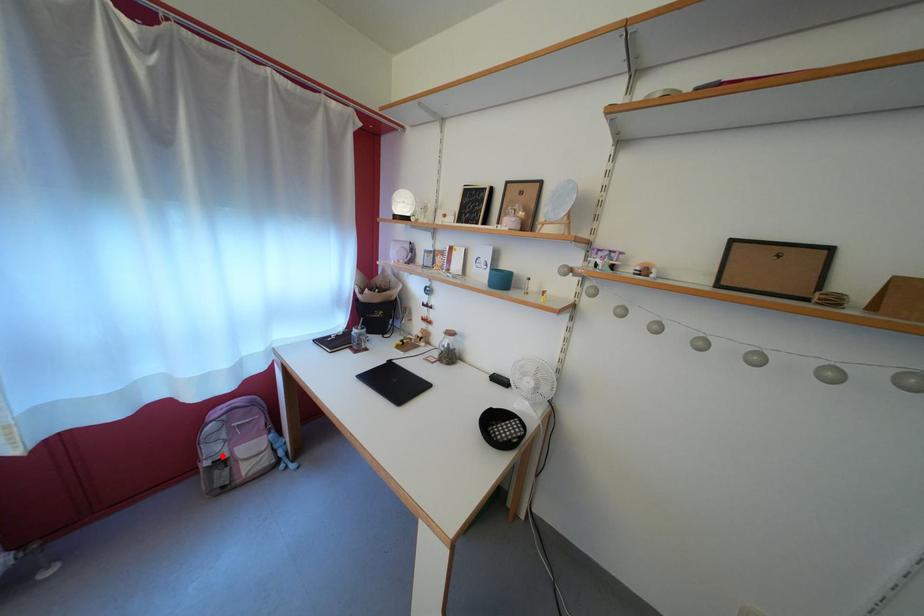
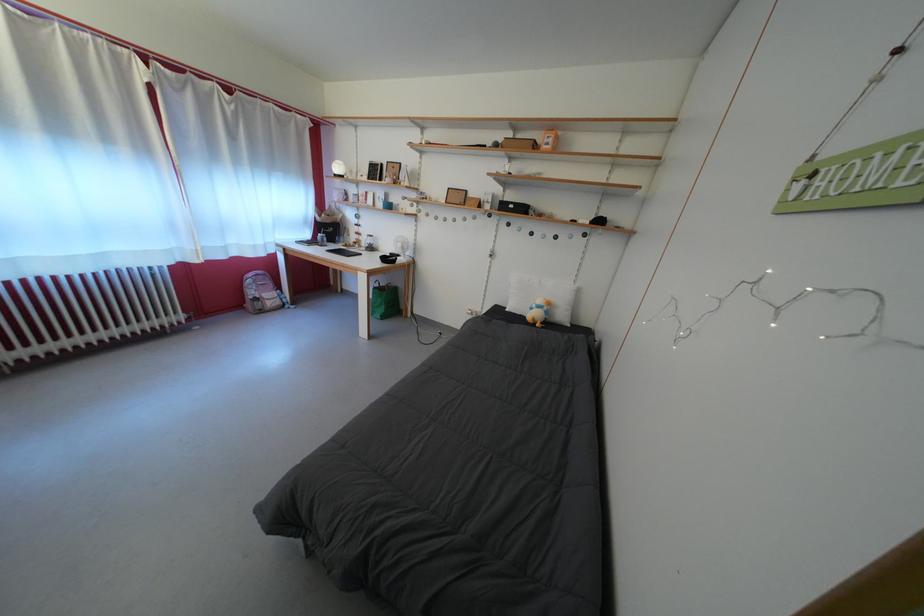
Locate, in the second image, the point that corresponds to the highlighted location in the first image.

(261, 299)